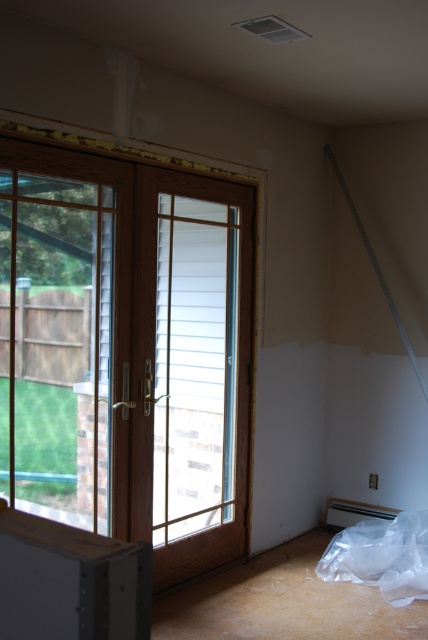
You are a delivery person holding a large package that is 3 feet wide. You need to enter through the clear glass door at left. Can you fit through the doorway without tilting the package? Please explain your reasoning based on the distance between you and the door.

The clear glass door at left and viewer are 8.58 feet apart. Since the package is 3 feet wide and the distance between you and the door is 8.58 feet, there is sufficient space to maneuver the package through the doorway without tilting it. However, the actual width of the doorway itself must also be considered to ensure it can accommodate the package. The provided information only specifies the distance between the viewer and the door, not the doorway width.

You are standing in the center of the room. The clear glass door at left is your only exit. To reach it, you must walk in which direction relative to your current position?

The clear glass door at left is located at coordinates 0.548 on the x axis and 0.297 on the y axis, so you should walk towards the left side of the room to reach it.